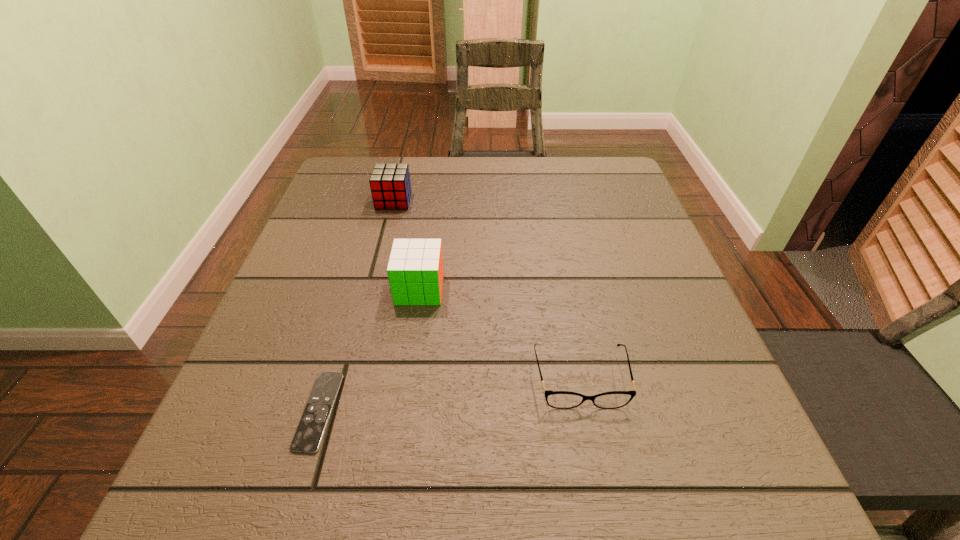
This screenshot has width=960, height=540. Find the location of `vacant area located on the right of the remote control`. vacant area located on the right of the remote control is located at coordinates (501, 411).

Where is `object at the far edge`? object at the far edge is located at coordinates click(x=390, y=184).

Locate an element on the screen. cube located in the left edge section of the desktop is located at coordinates (390, 184).

Where is `remote control situated at the left edge`? This screenshot has height=540, width=960. remote control situated at the left edge is located at coordinates (310, 431).

Where is `object that is at the right edge`? object that is at the right edge is located at coordinates (556, 399).

Where is `object at the far left corner`? This screenshot has height=540, width=960. object at the far left corner is located at coordinates (390, 184).

In the image, there is a desktop. At what (x,y) coordinates should I click in order to perform the action: click on vacant space at the far edge. Please return your answer as a coordinate pair (x, y). The height and width of the screenshot is (540, 960). Looking at the image, I should click on (492, 203).

Identify the location of vacant space at the near edge of the desktop. This screenshot has width=960, height=540. (312, 497).

The width and height of the screenshot is (960, 540). In the image, there is a desktop. Find the location of `vacant region at the left edge`. vacant region at the left edge is located at coordinates (315, 285).

You are a GUI agent. You are given a task and a screenshot of the screen. Output one action in this format:
    pyautogui.click(x=<x>, y=<y>)
    Task: Click on the free space at the right edge of the desktop
    The image size is (960, 540).
    Given the screenshot: What is the action you would take?
    pyautogui.click(x=658, y=249)